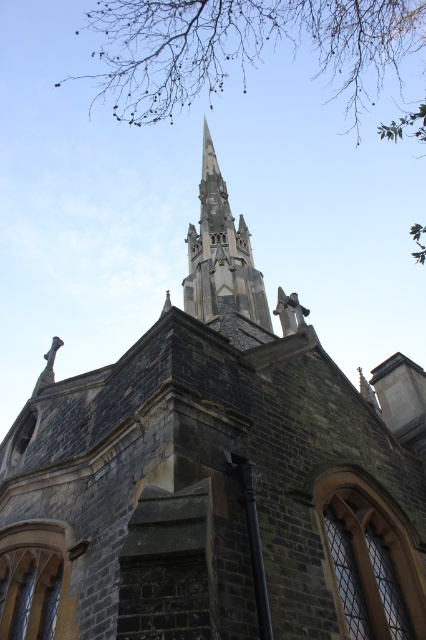
You are standing at the base of the church, looking upward. You notice the brown leafy branches at upper center and the smooth gray stone spire at upper center. Which object is closer to you?

The smooth gray stone spire at upper center is closer to you because it is part of the church structure, while the brown leafy branches at upper center are farther away at 50.90 meters distance from the spire.

You are an architect analyzing the church structure. You notice the brown leafy branches at upper center and the smooth gray stone spire at upper center in the image. Which object occupies more space in the upper center area?

The brown leafy branches at upper center occupies more space in the upper center area than the smooth gray stone spire at upper center, as it is bigger in size according to the description.

You are a bird flying over the historic stone church. You see the brown leafy branches at upper center and the smooth gray stone spire at upper center. Which object is located above the other?

The brown leafy branches at upper center is positioned over smooth gray stone spire at upper center, so the branches are above the spire.